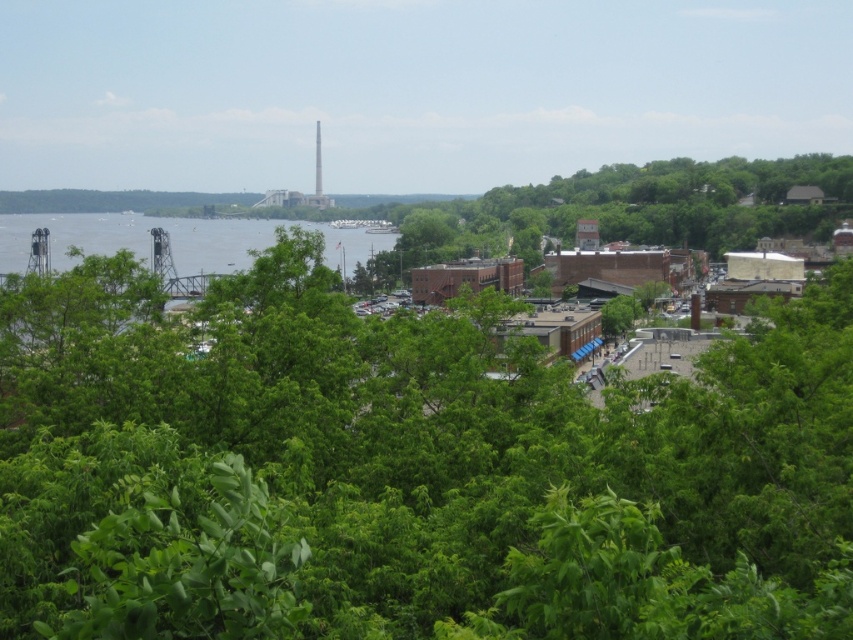
Question: Which of the following is the closest to the observer?

Choices:
 (A) white concrete tower at upper center
 (B) green leafy tree at center

Answer: (B)

Question: In this image, where is green leafy tree at upper right located relative to green water at left?

Choices:
 (A) below
 (B) above

Answer: (B)

Question: Among these points, which one is nearest to the camera?

Choices:
 (A) (252, 372)
 (B) (315, 179)
 (C) (704, 209)

Answer: (A)

Question: Does green leafy tree at center lie behind white concrete tower at upper center?

Choices:
 (A) yes
 (B) no

Answer: (B)

Question: Is green leafy tree at center to the left of white concrete tower at upper center from the viewer's perspective?

Choices:
 (A) no
 (B) yes

Answer: (A)

Question: Which object appears closest to the camera in this image?

Choices:
 (A) green water at left
 (B) green leafy tree at upper right
 (C) white concrete tower at upper center

Answer: (A)